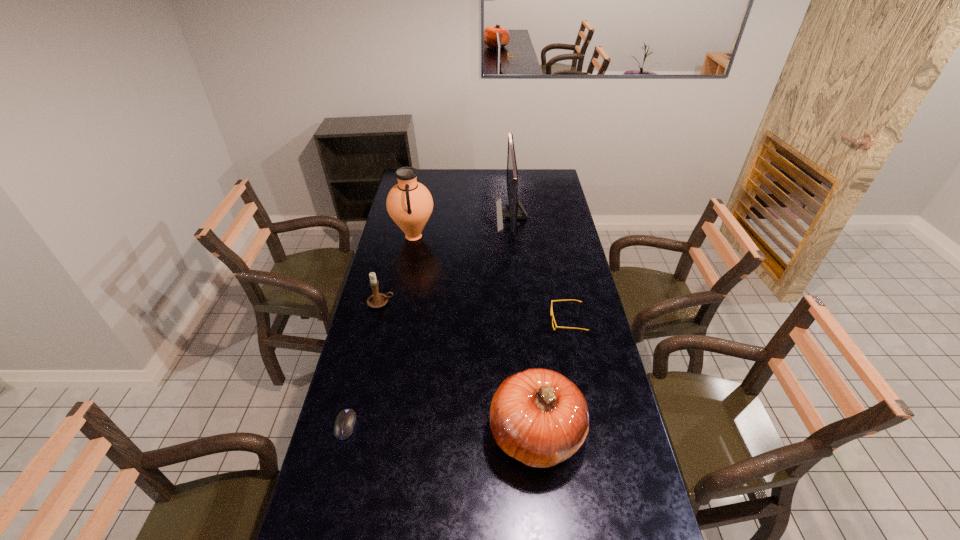
Where is `spectacles that is positioned at the right edge`? This screenshot has height=540, width=960. spectacles that is positioned at the right edge is located at coordinates (552, 316).

This screenshot has height=540, width=960. Identify the location of blank area at the far edge. (483, 179).

This screenshot has width=960, height=540. Identify the location of vacant space at the left edge. (372, 505).

You are a GUI agent. You are given a task and a screenshot of the screen. Output one action in this format:
    pyautogui.click(x=<x>, y=<y>)
    Task: Click on the blank area at the right edge
    The image size is (960, 540).
    Given the screenshot: What is the action you would take?
    pyautogui.click(x=584, y=268)

This screenshot has width=960, height=540. In the image, there is a desktop. Find the location of `vacant space at the far right corner`. vacant space at the far right corner is located at coordinates (542, 176).

Locate an element on the screen. The image size is (960, 540). vacant area that lies between the computer mouse and the pitcher is located at coordinates (380, 331).

Locate an element on the screen. The width and height of the screenshot is (960, 540). vacant region between the fifth tallest object and the fourth tallest object is located at coordinates (474, 312).

Image resolution: width=960 pixels, height=540 pixels. What are the coordinates of `free space that is in between the fifth tallest object and the third shortest object` in the screenshot? It's located at (474, 312).

Where is `empty space that is in between the monitor and the fifth tallest object`? This screenshot has height=540, width=960. empty space that is in between the monitor and the fifth tallest object is located at coordinates [540, 268].

Find the location of `blank region between the pitcher and the spectacles`. blank region between the pitcher and the spectacles is located at coordinates coord(491,279).